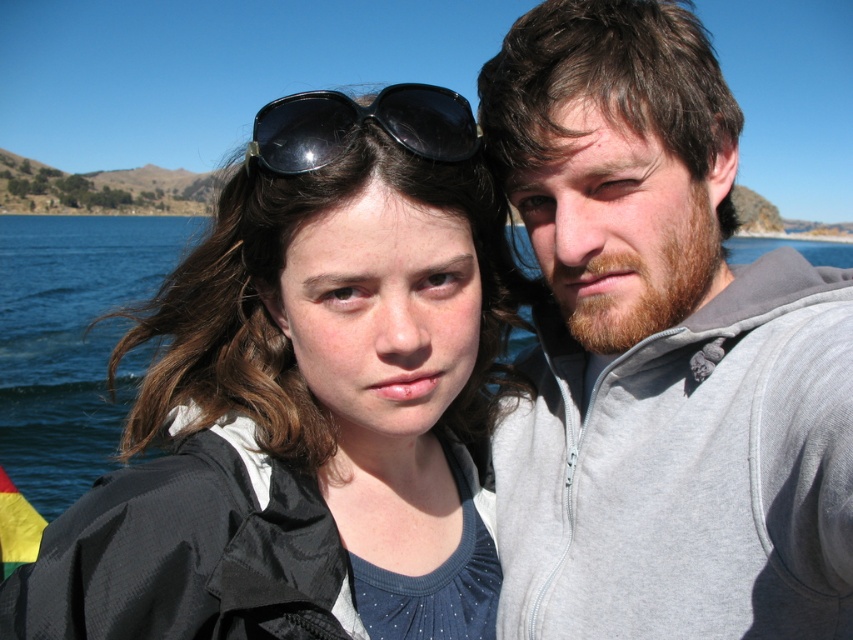
Who is higher up, gray zip-up hoodie at center or black reflective sunglasses at center?

black reflective sunglasses at center is higher up.

Based on the photo, does gray zip-up hoodie at center have a larger size compared to black reflective sunglasses at center?

Actually, gray zip-up hoodie at center might be smaller than black reflective sunglasses at center.

Does point (573, 202) come farther from viewer compared to point (434, 104)?

Yes, it is.

Locate an element on the screen. The width and height of the screenshot is (853, 640). gray zip-up hoodie at center is located at coordinates tap(660, 353).

Who is positioned more to the left, matte black jacket at center or gray zip-up hoodie at center?

From the viewer's perspective, matte black jacket at center appears more on the left side.

Is matte black jacket at center shorter than gray zip-up hoodie at center?

Correct, matte black jacket at center is not as tall as gray zip-up hoodie at center.

The width and height of the screenshot is (853, 640). I want to click on matte black jacket at center, so click(x=308, y=401).

Where is `matte black jacket at center`? matte black jacket at center is located at coordinates (308, 401).

Is matte black jacket at center smaller than black reflective sunglasses at center?

Correct, matte black jacket at center occupies less space than black reflective sunglasses at center.

Between point (445, 524) and point (412, 140), which one is positioned behind?

The point (445, 524) is more distant.

Find the location of a particular element. The image size is (853, 640). matte black jacket at center is located at coordinates (308, 401).